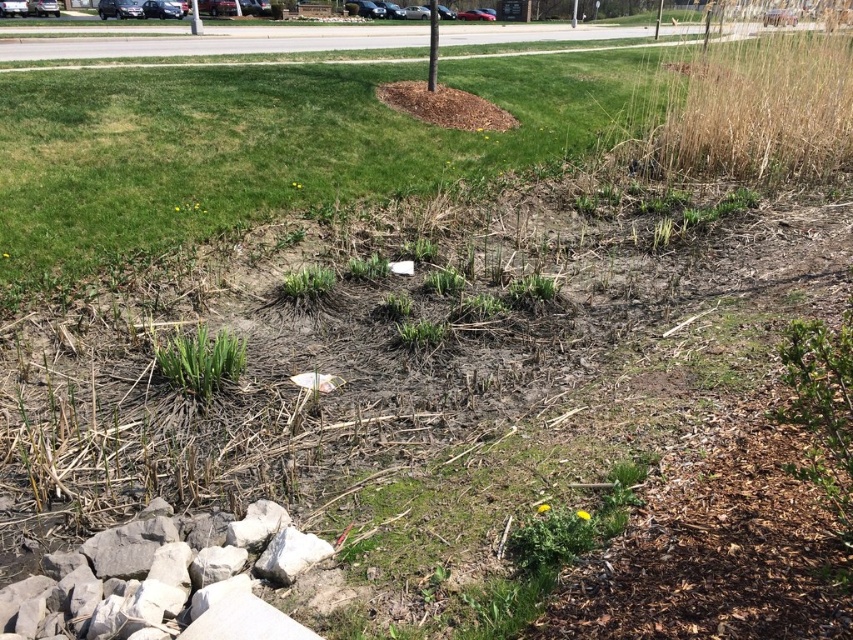
You are standing in the landscaped area and want to reach the smooth gray pole at center without stepping on the green grass at center. Is this possible?

The green grass at center is closer to the viewer than the smooth gray pole at center. Therefore, you can walk around the green grass at center to reach the smooth gray pole at center without stepping on it.

Consider the image. You are a gardener who needs to place a new decorative stone that is 1.2 meters wide. You see the green grass at center and the smooth gray pole at center. Which area can accommodate the stone without exceeding its width?

The green grass at center has a width larger than the smooth gray pole at center, so the stone can be placed on the green grass at center since its width is sufficient to accommodate the 1.2 meter wide stone.

You are standing at the edge of the image and want to walk towards the green grass at center. Which direction should you move in to reach it?

Since the green grass at center is located at point 0.564 on the x axis and 0.237 on the y axis, you should move towards the center of the image to reach it.